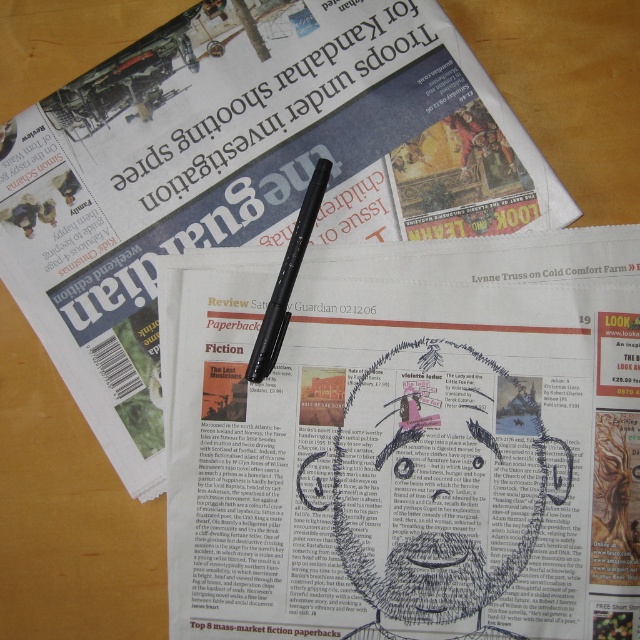
You are a writer who needs to write a review for the book mentioned in the newspaper. You have a white paper at center and a black plastic pen at center. Which object should you use to start writing your review?

The white paper at center is taller than the black plastic pen at center, so you should use the black plastic pen at center to write on the white paper at center.

Based on the photo, you are a writer who needs to write a review for the book mentioned in the newspaper. You have a white paper at center and a black plastic pen at center. Which object should you use first to start writing the review?

You should use the black plastic pen at center first because it is farther away from the viewer than the white paper at center, so you need to reach for it before starting to write on the white paper at center.